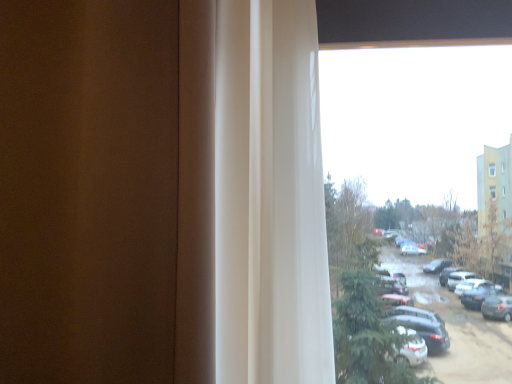
Describe the element at coordinates (413, 22) in the screenshot. This screenshot has height=384, width=512. I see `transparent glass window at upper right` at that location.

Where is `transparent glass window at upper right`? transparent glass window at upper right is located at coordinates (413, 22).

You are a GUI agent. You are given a task and a screenshot of the screen. Output one action in this format:
    pyautogui.click(x=<x>, y=<y>)
    Task: Click on the transparent glass window at upper right
    
    Given the screenshot: What is the action you would take?
    pyautogui.click(x=413, y=22)